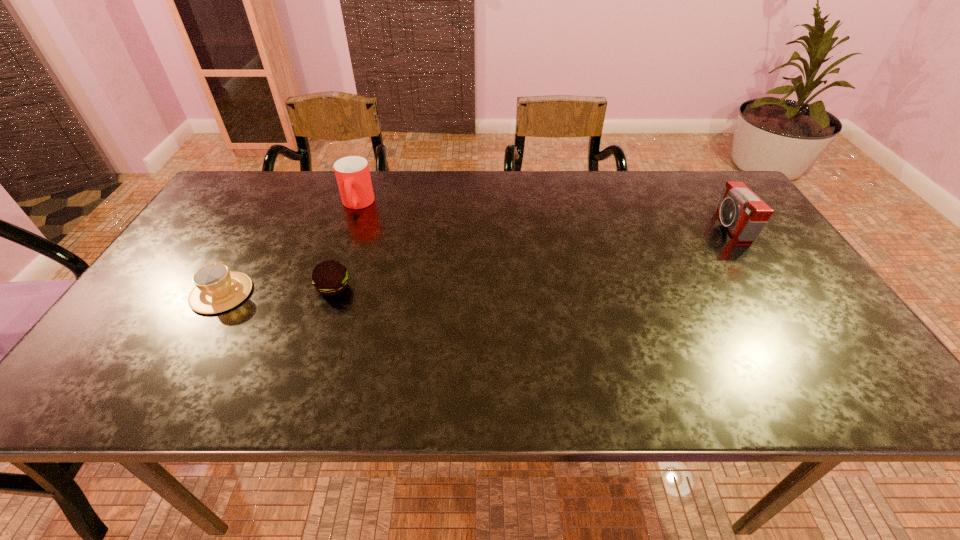
The width and height of the screenshot is (960, 540). I want to click on vacant area that lies between the patty and the nearer cup, so click(x=277, y=291).

Where is `free point between the nearer cup and the farther cup`? This screenshot has height=540, width=960. free point between the nearer cup and the farther cup is located at coordinates (290, 249).

Locate an element on the screen. This screenshot has height=540, width=960. empty location between the camera and the nearer cup is located at coordinates (476, 260).

Locate an element on the screen. object that stands as the second closest to the shorter cup is located at coordinates (352, 173).

Point out which object is positioned as the third nearest to the leftmost object. Please provide its 2D coordinates. Your answer should be formatted as a tuple, i.e. [(x, y)], where the tuple contains the x and y coordinates of a point satisfying the conditions above.

[(745, 215)]

This screenshot has width=960, height=540. Find the location of `vacant region that satisfies the following two spatial constraints: 1. on the side of the patty with the handle; 2. on the right side of the taller cup`. vacant region that satisfies the following two spatial constraints: 1. on the side of the patty with the handle; 2. on the right side of the taller cup is located at coordinates 328,288.

The width and height of the screenshot is (960, 540). Identify the location of vacant space that satisfies the following two spatial constraints: 1. on the side of the taller cup with the handle; 2. on the right side of the patty. (328, 288).

Find the location of a particular element. The image size is (960, 540). free space that satisfies the following two spatial constraints: 1. on the side of the right cup with the handle; 2. on the left side of the patty is located at coordinates (328, 288).